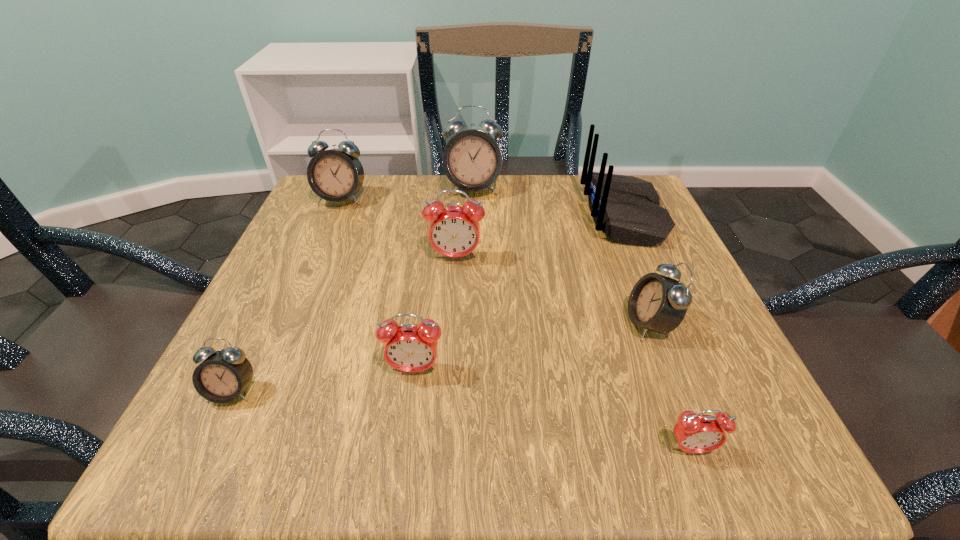
I want to click on free space at the left edge of the desktop, so click(281, 304).

I want to click on free region at the right edge of the desktop, so click(601, 240).

The image size is (960, 540). In order to click on free spot at the near right corner of the desktop in this screenshot , I will do `click(659, 413)`.

I want to click on vacant point located between the nearest red alarm clock and the nearest white alarm clock, so click(462, 420).

Find the location of a particular element. free space between the nearest alarm clock and the fourth nearest object is located at coordinates (670, 387).

At what (x,y) coordinates should I click in order to perform the action: click on unoccupied area between the fifth farthest object and the biggest white alarm clock. Please return your answer as a coordinate pair (x, y). Looking at the image, I should click on (561, 256).

The height and width of the screenshot is (540, 960). What are the coordinates of `vacant space in between the nearest alarm clock and the biggest white alarm clock` in the screenshot? It's located at (582, 319).

Locate an element on the screen. The width and height of the screenshot is (960, 540). vacant space that's between the fifth nearest alarm clock and the second nearest red alarm clock is located at coordinates coord(435,313).

At what (x,y) coordinates should I click in order to perform the action: click on vacant area that lies between the router and the second farthest red alarm clock. Please return your answer as a coordinate pair (x, y). The height and width of the screenshot is (540, 960). Looking at the image, I should click on (518, 292).

Image resolution: width=960 pixels, height=540 pixels. Find the location of `empty space that is in between the farthest red alarm clock and the nearest red alarm clock`. empty space that is in between the farthest red alarm clock and the nearest red alarm clock is located at coordinates (573, 353).